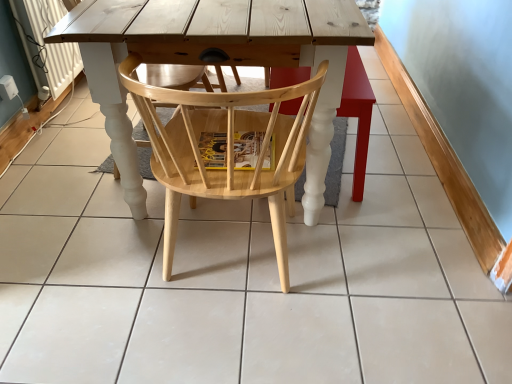
What do you see at coordinates (357, 114) in the screenshot?
I see `wooden chair at center` at bounding box center [357, 114].

Where is `wooden chair at center`? Image resolution: width=512 pixels, height=384 pixels. wooden chair at center is located at coordinates (357, 114).

Image resolution: width=512 pixels, height=384 pixels. I want to click on natural wood chair at center, so click(x=225, y=150).

This screenshot has width=512, height=384. What do you see at coordinates (225, 150) in the screenshot?
I see `natural wood chair at center` at bounding box center [225, 150].

Locate an element on the screen. Image resolution: width=512 pixels, height=384 pixels. wooden chair at center is located at coordinates (357, 114).

Considering the positions of objects wooden chair at center and natural wood chair at center in the image provided, who is more to the left, wooden chair at center or natural wood chair at center?

Positioned to the left is natural wood chair at center.

Which object is more forward, wooden chair at center or natural wood chair at center?

natural wood chair at center is in front.

Is point (327, 203) positioned behind point (127, 62)?

Yes, it is.

Consider the image. From the image's perspective, is wooden chair at center on natural wood chair at center?

Yes.

From a real-world perspective, does wooden chair at center sit lower than natural wood chair at center?

Yes.

Which object is wider, wooden chair at center or natural wood chair at center?

With larger width is natural wood chair at center.

Does wooden chair at center have a lesser height compared to natural wood chair at center?

Yes, wooden chair at center is shorter than natural wood chair at center.

Is wooden chair at center bigger than natural wood chair at center?

Actually, wooden chair at center might be smaller than natural wood chair at center.

Is wooden chair at center not within natural wood chair at center?

wooden chair at center is positioned outside natural wood chair at center.

Is wooden chair at center far away from natural wood chair at center?

They are positioned close to each other.

Is wooden chair at center facing towards natural wood chair at center?

No, wooden chair at center is not oriented towards natural wood chair at center.

From the picture: How far apart are wooden chair at center and natural wood chair at center?

wooden chair at center is 10.40 inches from natural wood chair at center.

Image resolution: width=512 pixels, height=384 pixels. Find the location of `bar stool above the natural wood chair at center (from the image's perspective)`. bar stool above the natural wood chair at center (from the image's perspective) is located at coordinates (357, 114).

Between natural wood chair at center and wooden chair at center, which one appears on the left side from the viewer's perspective?

natural wood chair at center is more to the left.

Is natural wood chair at center positioned behind wooden chair at center?

No, natural wood chair at center is closer to the camera.

Which point is more forward, (271, 213) or (360, 89)?

The point (271, 213) is in front.

From the image's perspective, which object appears higher, natural wood chair at center or wooden chair at center?

From the image's view, wooden chair at center is above.

From a real-world perspective, is natural wood chair at center on wooden chair at center?

Yes, from a real-world perspective, natural wood chair at center is on top of wooden chair at center.

Considering the sizes of objects natural wood chair at center and wooden chair at center in the image provided, who is thinner, natural wood chair at center or wooden chair at center?

With smaller width is wooden chair at center.

From their relative heights in the image, would you say natural wood chair at center is taller or shorter than wooden chair at center?

natural wood chair at center is taller than wooden chair at center.

Is natural wood chair at center bigger than wooden chair at center?

Indeed, natural wood chair at center has a larger size compared to wooden chair at center.

Would you say natural wood chair at center is inside or outside wooden chair at center?

natural wood chair at center is outside wooden chair at center.

Would you consider natural wood chair at center to be distant from wooden chair at center?

No, natural wood chair at center is in close proximity to wooden chair at center.

Does natural wood chair at center turn towards wooden chair at center?

No, natural wood chair at center is not turned towards wooden chair at center.

Image resolution: width=512 pixels, height=384 pixels. In the image, there is a wooden chair at center. What are the coordinates of `chair below it (from the image's perspective)` in the screenshot? It's located at (225, 150).

The image size is (512, 384). I want to click on bar stool lying on the right of natural wood chair at center, so click(357, 114).

Find the location of a particular element. The width and height of the screenshot is (512, 384). chair that appears in front of the wooden chair at center is located at coordinates (225, 150).